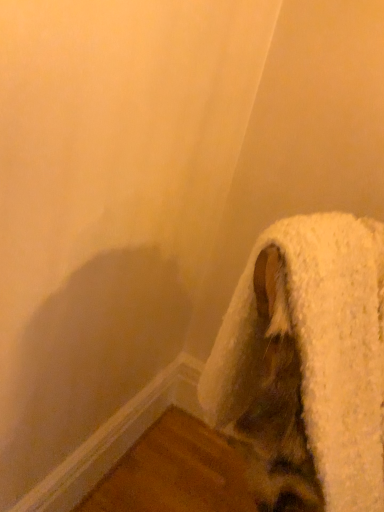
You are a GUI agent. You are given a task and a screenshot of the screen. Output one action in this format:
    pyautogui.click(x=<x>, y=<y>)
    Task: Click on the white fluffy towel at lower right
    The image size is (384, 512).
    Given the screenshot: What is the action you would take?
    pyautogui.click(x=306, y=365)

The image size is (384, 512). What do you see at coordinates (306, 365) in the screenshot?
I see `white fluffy towel at lower right` at bounding box center [306, 365].

I want to click on white fluffy towel at lower right, so click(x=306, y=365).